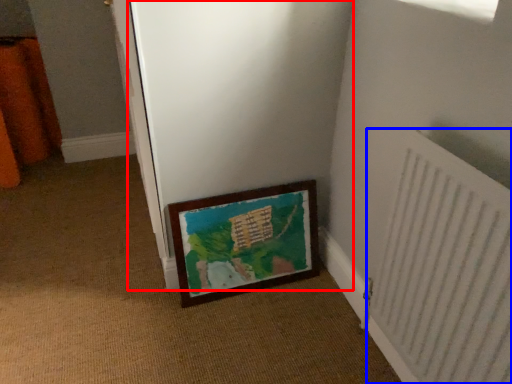
Question: Among these objects, which one is nearest to the camera, screen door (highlighted by a red box) or radiator (highlighted by a blue box)?

Choices:
 (A) screen door
 (B) radiator

Answer: (B)